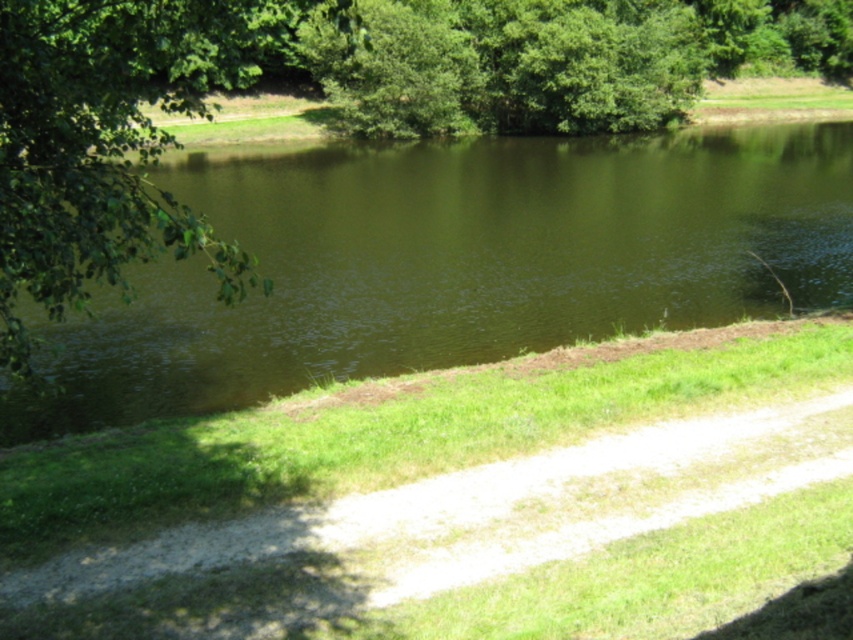
Question: Which point appears closest to the camera in this image?

Choices:
 (A) (561, 284)
 (B) (33, 262)

Answer: (B)

Question: Does green water at center appear under green leafy tree at left?

Choices:
 (A) yes
 (B) no

Answer: (A)

Question: Among these objects, which one is farthest from the camera?

Choices:
 (A) green leafy tree at left
 (B) green water at center

Answer: (B)

Question: Can you confirm if green water at center is positioned to the left of green leafy tree at left?

Choices:
 (A) yes
 (B) no

Answer: (B)

Question: Which point appears farthest from the camera in this image?

Choices:
 (A) (71, 419)
 (B) (26, 68)

Answer: (A)

Question: Is green water at center wider than green leafy tree at left?

Choices:
 (A) yes
 (B) no

Answer: (A)